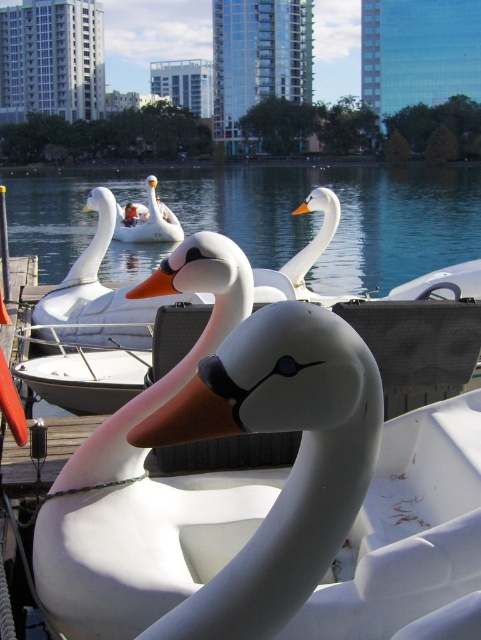
Can you confirm if white glossy swan at upper center is positioned below orange matte beak at upper center?

Incorrect, white glossy swan at upper center is not positioned below orange matte beak at upper center.

Looking at this image, which of these two, white glossy swan at upper center or orange matte beak at upper center, stands taller?

Standing taller between the two is orange matte beak at upper center.

What do you see at coordinates (148, 220) in the screenshot? I see `white glossy swan at upper center` at bounding box center [148, 220].

The height and width of the screenshot is (640, 481). In order to click on white glossy swan at upper center in this screenshot , I will do `click(148, 220)`.

Is point (154, 294) behind point (302, 211)?

No, (154, 294) is closer to viewer.

Identify the location of orange matte beak at center. (154, 284).

Who is higher up, clear blue water at center or matte white swan at center?

clear blue water at center is above.

The height and width of the screenshot is (640, 481). What do you see at coordinates (269, 216) in the screenshot? I see `clear blue water at center` at bounding box center [269, 216].

Identify the location of clear blue water at center. The width and height of the screenshot is (481, 640). (269, 216).